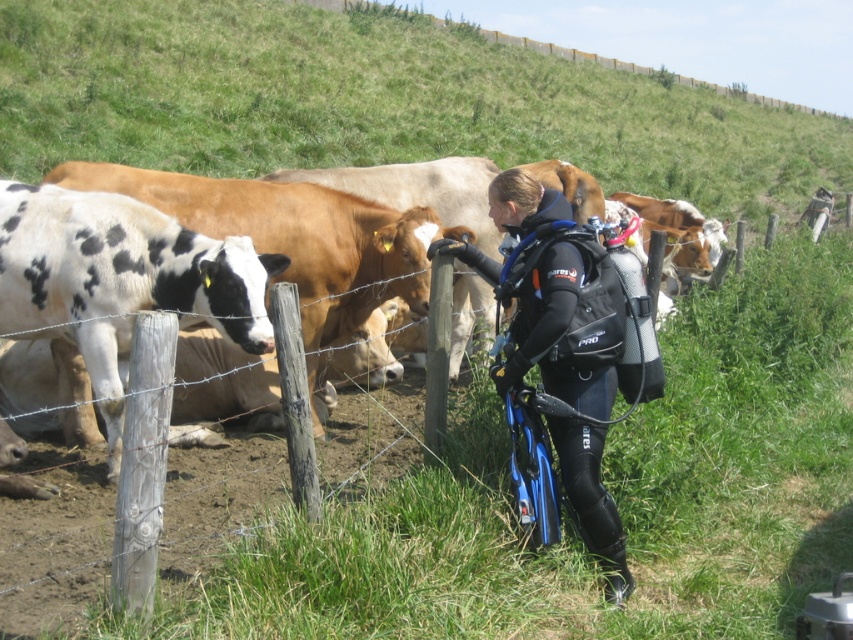
Question: Is wooden post at center positioned at the back of black neoprene wetsuit at center?

Choices:
 (A) yes
 (B) no

Answer: (A)

Question: Which point appears closest to the camera in this image?

Choices:
 (A) (618, 577)
 (B) (386, 512)

Answer: (B)

Question: Is wooden post at center below black neoprene wetsuit at center?

Choices:
 (A) no
 (B) yes

Answer: (B)

Question: Can you confirm if wooden post at center is positioned to the left of black neoprene wetsuit at center?

Choices:
 (A) yes
 (B) no

Answer: (A)

Question: Which point is closer to the camera taking this photo?

Choices:
 (A) (538, 340)
 (B) (842, 396)

Answer: (A)

Question: Which point appears farthest from the camera in this image?

Choices:
 (A) (537, 609)
 (B) (514, 212)

Answer: (B)